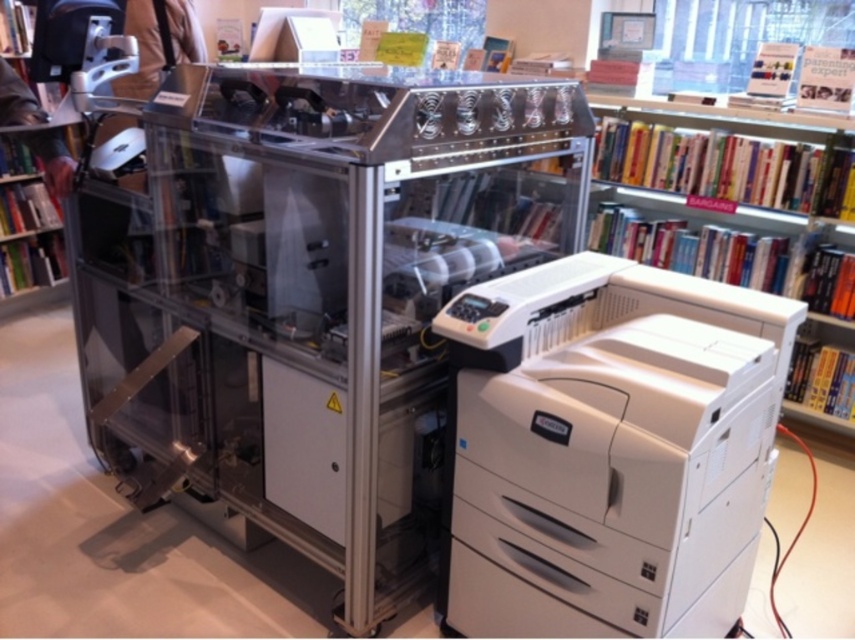
Looking at this image, you are a delivery person who needs to place a box that is 1.5 meters long between the white plastic printer at center and the green matte bookshelf at lower left. Can you fit the box horizontally between them without moving either object?

The distance between the white plastic printer at center and the green matte bookshelf at lower left is 1.65 meters. Since the box is 1.5 meters long, it can fit horizontally between them as the available space is slightly larger than the box.

You are standing at the point labeled point (33, 144) and want to move to the point labeled point (848, 416). Which direction should you move in order to reach your destination?

To reach point (848, 416) from point (33, 144), you should move towards the back of the space since point (848, 416) is located behind point (33, 144).

You are organizing books in a bookstore and need to place both the hardcover books at right and the green matte bookshelf at lower left. Which object is wider?

The hardcover books at right are wider than the green matte bookshelf at lower left.